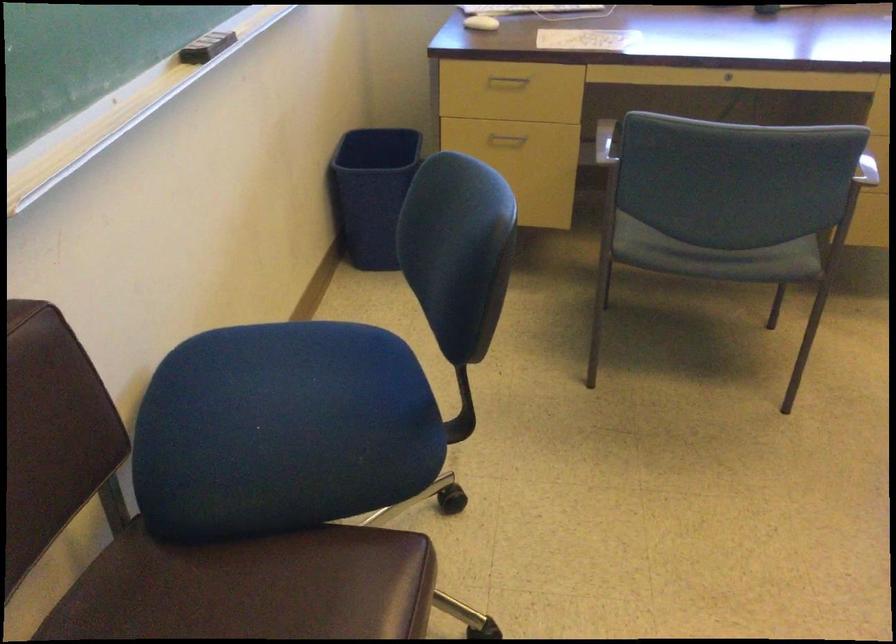
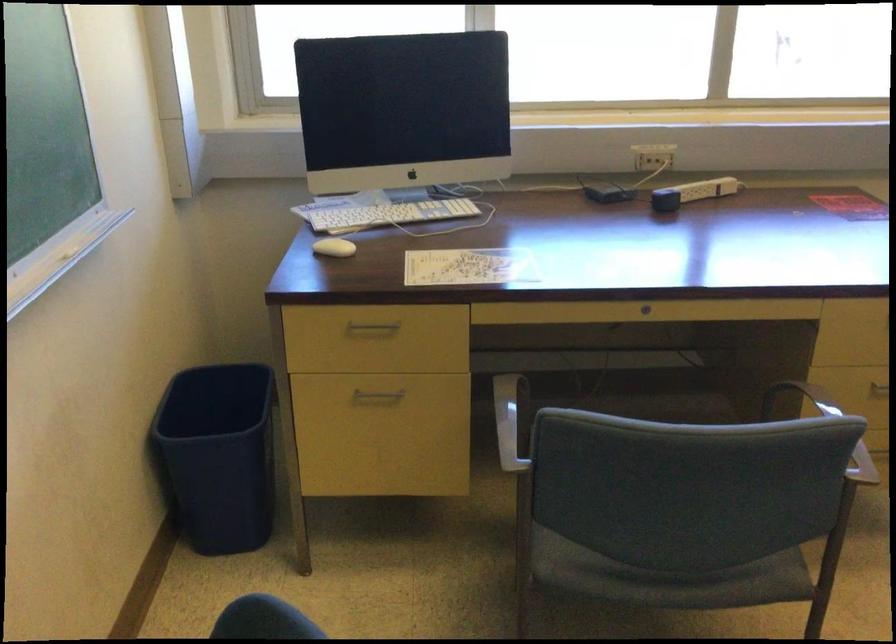
The point at (727, 75) is marked in the first image. Where is the corresponding point in the second image?

(645, 308)